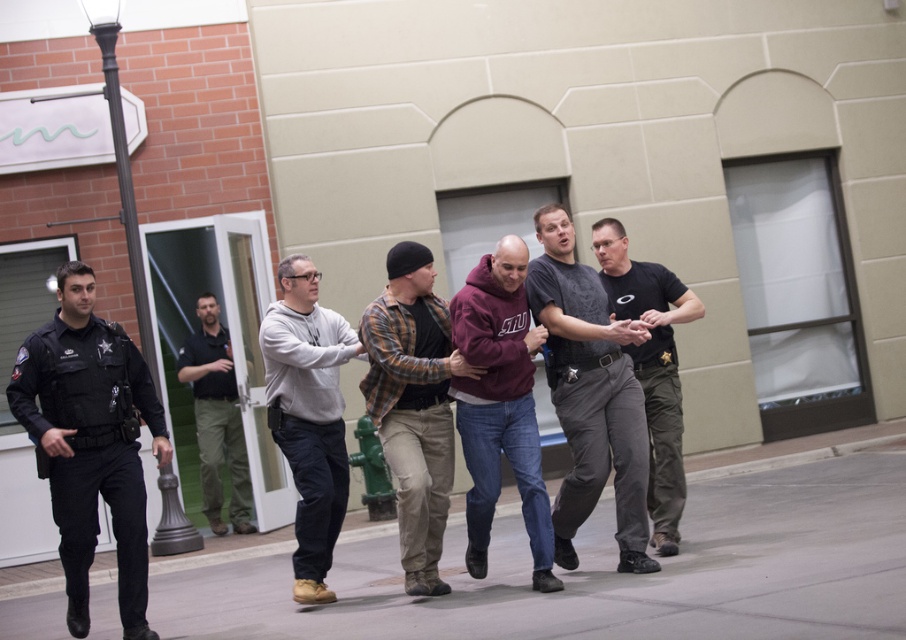
Question: Is maroon hoodie at center further to the viewer compared to gray fleece sweatshirt at center?

Choices:
 (A) no
 (B) yes

Answer: (A)

Question: Which of the following is the farthest from the observer?

Choices:
 (A) (x=676, y=465)
 (B) (x=111, y=500)

Answer: (A)

Question: Estimate the real-world distances between objects in this image. Which object is closer to the plaid flannel shirt at center?

Choices:
 (A) black uniformed officer at left
 (B) black uniform pants at center
 (C) dark gray uniform at center
 (D) maroon hoodie at center

Answer: (D)

Question: Estimate the real-world distances between objects in this image. Which object is farther from the black uniform at center?

Choices:
 (A) black uniform pants at center
 (B) plaid flannel shirt at center

Answer: (A)

Question: In this image, where is black uniform pants at center located relative to black uniform at center?

Choices:
 (A) above
 (B) below

Answer: (A)

Question: Is the position of gray concrete pavement at center less distant than that of gray fleece sweatshirt at center?

Choices:
 (A) no
 (B) yes

Answer: (A)